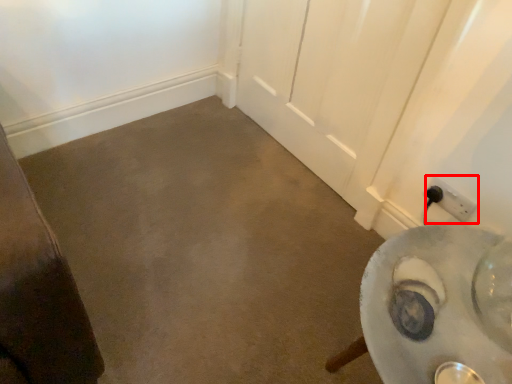
Question: From the image's perspective, where is power plugs and sockets (annotated by the red box) located in relation to concrete in the image?

Choices:
 (A) below
 (B) above

Answer: (B)